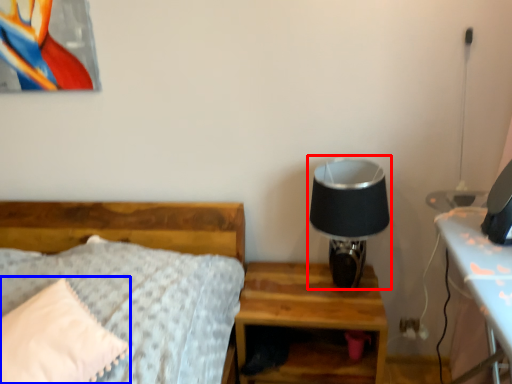
Question: Which object is closer to the camera taking this photo, table lamp (highlighted by a red box) or pillow (highlighted by a blue box)?

Choices:
 (A) table lamp
 (B) pillow

Answer: (B)